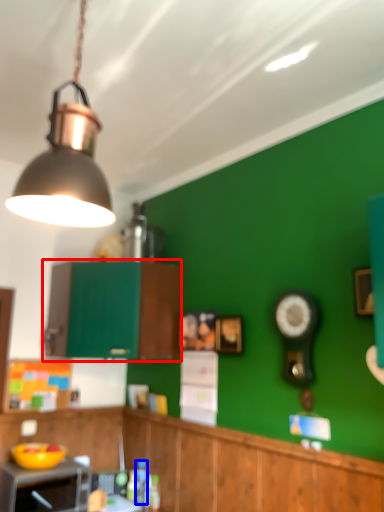
Question: Which of the following is the farthest to the observer, cabinetry (highlighted by a red box) or bottle (highlighted by a blue box)?

Choices:
 (A) cabinetry
 (B) bottle

Answer: (B)